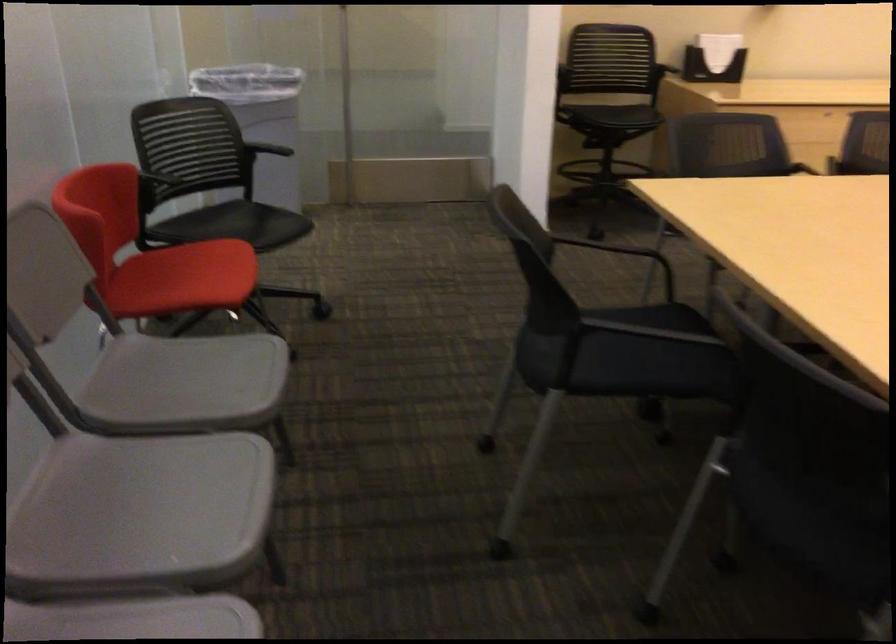
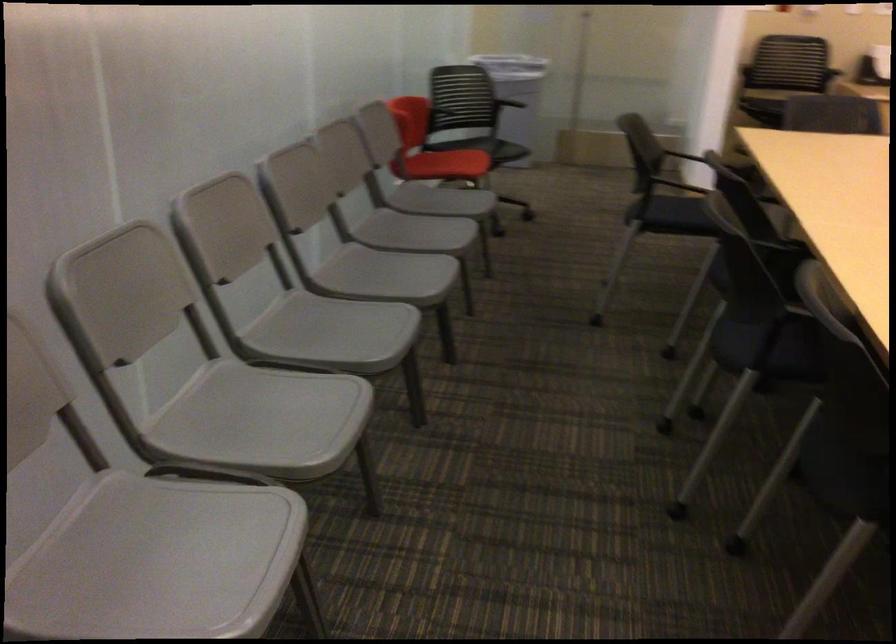
In the second image, find the point that corresponds to (595,357) in the first image.

(676, 211)